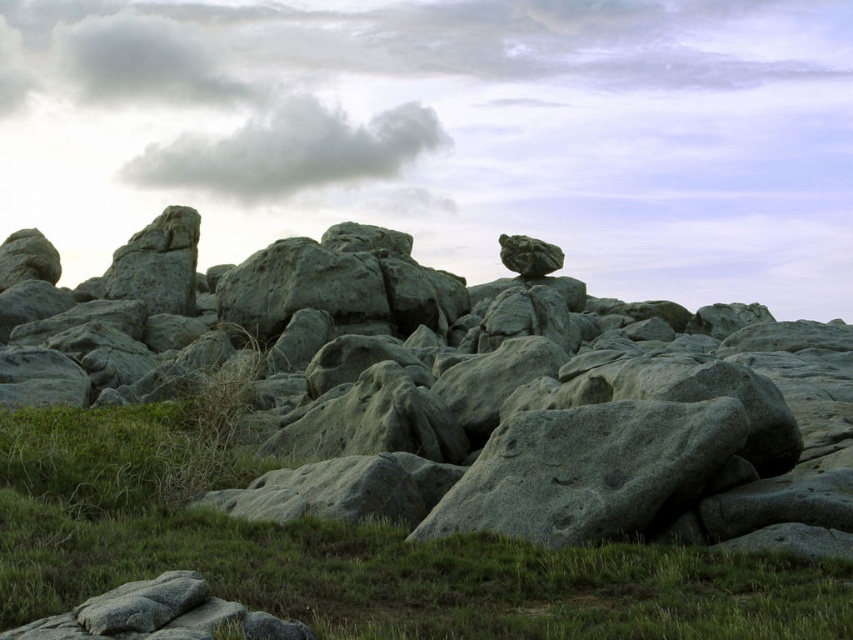
Between gray rough rock at center and gray fluffy cloud at upper center, which one appears on the left side from the viewer's perspective?

gray fluffy cloud at upper center is more to the left.

Is point (701, 515) in front of point (306, 109)?

Yes, it is in front of point (306, 109).

Locate an element on the screen. The image size is (853, 640). gray rough rock at center is located at coordinates (468, 392).

Can you confirm if green grassy at lower center is smaller than gray fluffy cloud at upper center?

Yes.

Who is positioned more to the left, green grassy at lower center or gray fluffy cloud at upper center?

From the viewer's perspective, gray fluffy cloud at upper center appears more on the left side.

Does point (294, 579) come farther from viewer compared to point (291, 125)?

That is False.

At what (x,y) coordinates should I click in order to perform the action: click on green grassy at lower center. Please return your answer as a coordinate pair (x, y). This screenshot has height=640, width=853. Looking at the image, I should click on (351, 552).

Who is positioned more to the left, gray rough rock at center or green grassy at lower center?

From the viewer's perspective, green grassy at lower center appears more on the left side.

Between point (334, 484) and point (22, 536), which one is positioned behind?

The point (334, 484) is more distant.

In order to click on gray rough rock at center in this screenshot , I will do `click(468, 392)`.

Identify the location of gray rough rock at center. The image size is (853, 640). (468, 392).